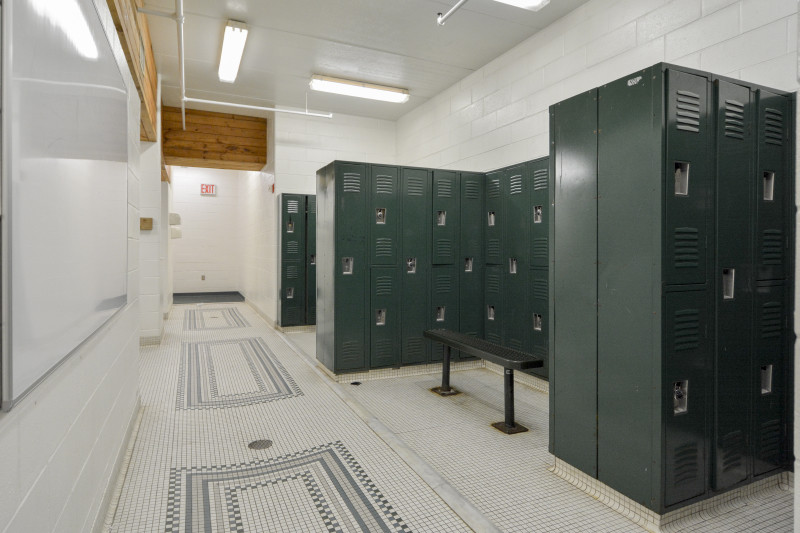
Where is `lights`? The width and height of the screenshot is (800, 533). lights is located at coordinates (526, 0), (373, 92), (232, 48).